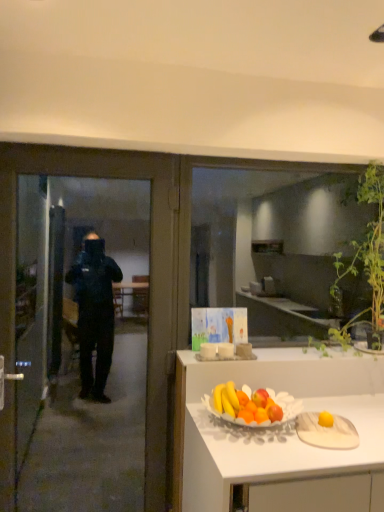
Locate an element on the screen. The image size is (384, 512). free location above transparent glass door at left (from a real-world perspective) is located at coordinates (96, 151).